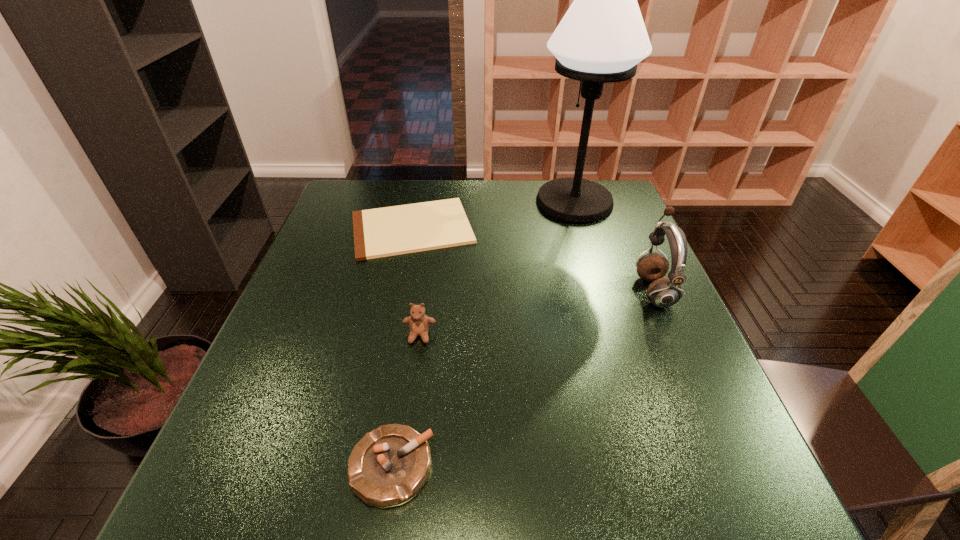
At what (x,y) coordinates should I click in order to perform the action: click on free space between the third tallest object and the table lamp. Please return your answer as a coordinate pair (x, y). Looking at the image, I should click on (497, 269).

I want to click on empty space that is in between the second nearest object and the second tallest object, so click(x=537, y=313).

Locate an element on the screen. This screenshot has height=540, width=960. free point between the second tallest object and the shortest object is located at coordinates (533, 259).

This screenshot has width=960, height=540. In order to click on free space between the table lamp and the clipboard in this screenshot , I will do `click(493, 215)`.

Identify the location of free space between the earphone and the fourth tallest object. [x=522, y=378].

You are a GUI agent. You are given a task and a screenshot of the screen. Output one action in this format:
    pyautogui.click(x=<x>, y=<y>)
    Task: Click on the vacant point located between the ashtray and the second tallest object
    
    Given the screenshot: What is the action you would take?
    pyautogui.click(x=522, y=378)

Where is `unoccupied position between the earphone and the table lamp`? The width and height of the screenshot is (960, 540). unoccupied position between the earphone and the table lamp is located at coordinates (614, 246).

Select which object appears as the closest to the clipboard. Please provide its 2D coordinates. Your answer should be formatted as a tuple, i.e. [(x, y)], where the tuple contains the x and y coordinates of a point satisfying the conditions above.

[(602, 37)]

Locate an element on the screen. The height and width of the screenshot is (540, 960). object that stands as the second closest to the shortest object is located at coordinates (419, 323).

You are a GUI agent. You are given a task and a screenshot of the screen. Output one action in this format:
    pyautogui.click(x=<x>, y=<y>)
    Task: Click on the vacant space that satisfies the following two spatial constraints: 1. on the ear pads of the earphone; 2. on the front-facing side of the third shortest object
    The width and height of the screenshot is (960, 540).
    Given the screenshot: What is the action you would take?
    pyautogui.click(x=674, y=335)